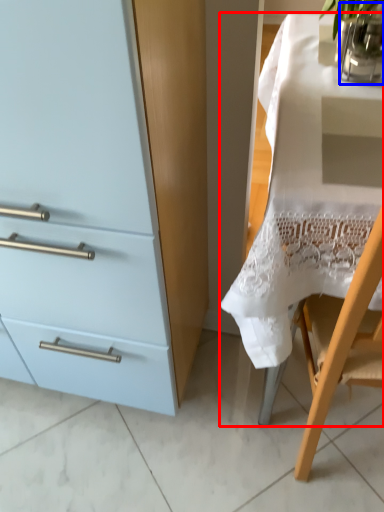
Question: Which object is closer to the camera taking this photo, desk (highlighted by a red box) or glass vase (highlighted by a blue box)?

Choices:
 (A) desk
 (B) glass vase

Answer: (A)